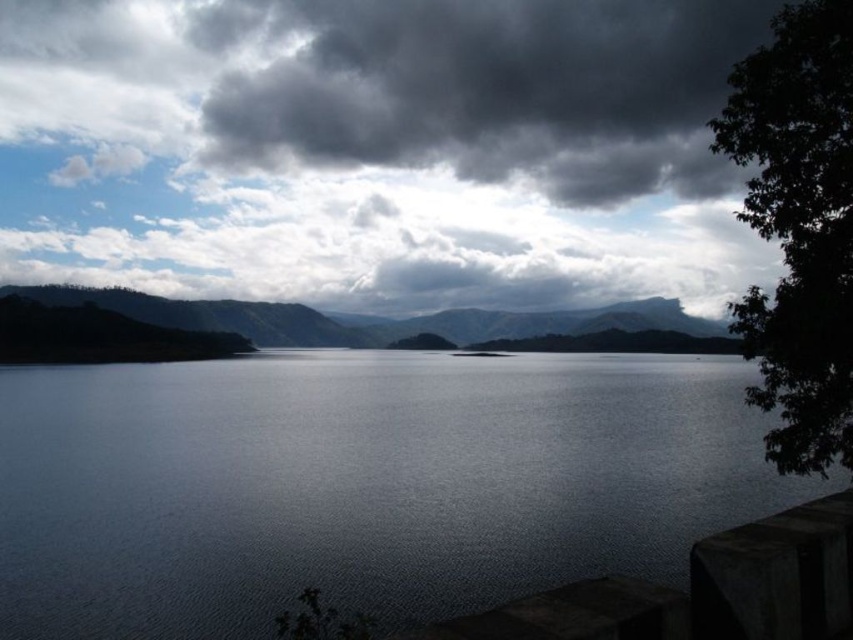
You are a weather balloon operator who needs to launch a balloon from the green matte mountain at center to reach the dark gray cloud at upper center. The balloon can ascend at a rate of 2 meters per second. How long will it take for the balloon to reach the cloud?

The distance between the dark gray cloud at upper center and the green matte mountain at center is 235.83 meters. At an ascent rate of 2 meters per second, the balloon will take 235.83 divided by 2, which equals approximately 117.915 seconds, or roughly 1 minute and 58 seconds, to reach the cloud.

From the picture: You are an airplane pilot flying over the serene landscape. You notice the dark gray cloud at upper center and the green matte mountain at center. Which object is closer to your plane?

The dark gray cloud at upper center is closer to your plane because it is further to the viewer than the green matte mountain at center.